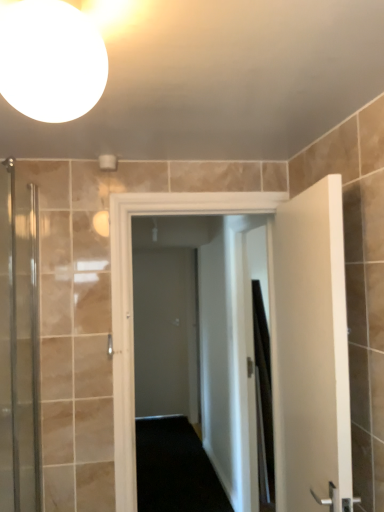
Question: Relative to clear glass shower door at left, is white matte door at right, which appears as the 1th door when viewed from the right, in front or behind?

Choices:
 (A) front
 (B) behind

Answer: (B)

Question: From a real-world perspective, is white matte door at right, which appears as the 1th door when viewed from the right, above or below clear glass shower door at left?

Choices:
 (A) below
 (B) above

Answer: (A)

Question: Which object is the farthest from the black fabric shower curtain at right?

Choices:
 (A) clear glass shower door at left
 (B) white glossy door at center, which ranks as the 1th door in left-to-right order
 (C) white matte door at right, the 2th door from the left
 (D) gray matte door at center
 (E) white glossy sphere at upper left

Answer: (E)

Question: Considering the real-world distances, which object is closest to the white matte door at right, the 2th door from the left?

Choices:
 (A) white glossy sphere at upper left
 (B) white glossy door at center, which ranks as the 1th door in left-to-right order
 (C) clear glass shower door at left
 (D) black fabric shower curtain at right
 (E) gray matte door at center

Answer: (B)